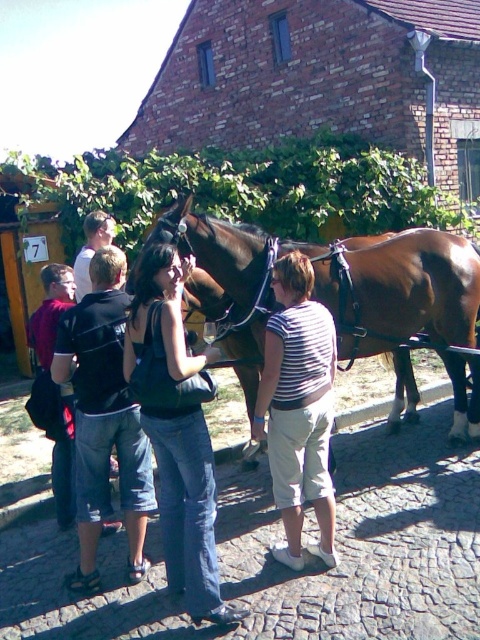
Question: Can you confirm if brown glossy horse at center is positioned to the left of striped fabric shirt at center?

Choices:
 (A) no
 (B) yes

Answer: (A)

Question: Among these objects, which one is nearest to the camera?

Choices:
 (A) brown glossy horse at center
 (B) striped fabric shirt at center
 (C) black cotton shirt at center
 (D) denim jeans at center

Answer: (D)

Question: Which point appears farthest from the camera in this image?

Choices:
 (A) (165, 358)
 (B) (92, 502)
 (C) (283, 444)

Answer: (B)

Question: Is denim jeans at center to the left of striped fabric shirt at center from the viewer's perspective?

Choices:
 (A) no
 (B) yes

Answer: (B)

Question: Which object is positioned farthest from the striped fabric shirt at center?

Choices:
 (A) black cotton shirt at center
 (B) brown glossy horse at center
 (C) denim jeans at center

Answer: (B)

Question: Does denim jeans at center appear on the right side of black cotton shirt at center?

Choices:
 (A) yes
 (B) no

Answer: (A)